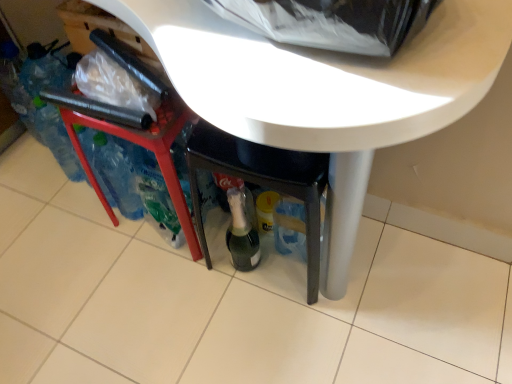
Identify the location of vacant space underneath white glossy table at center (from a real-world perspective). The image size is (512, 384). 190,260.